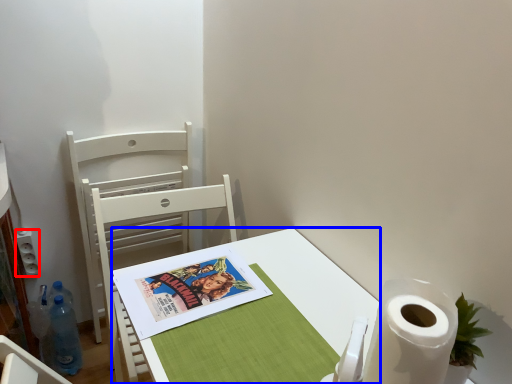
Question: Which object is further to the camera taking this photo, power outlet (highlighted by a red box) or desk (highlighted by a blue box)?

Choices:
 (A) power outlet
 (B) desk

Answer: (A)